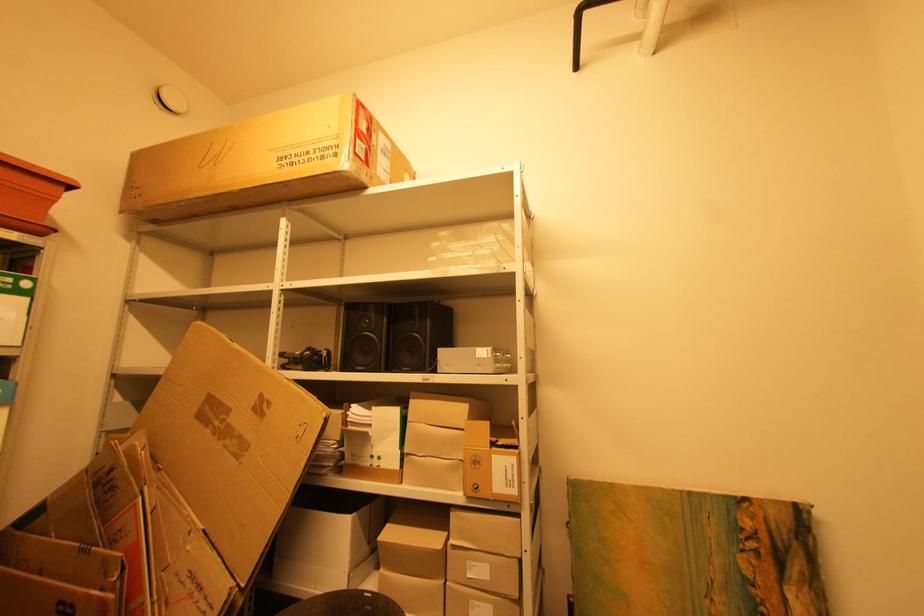
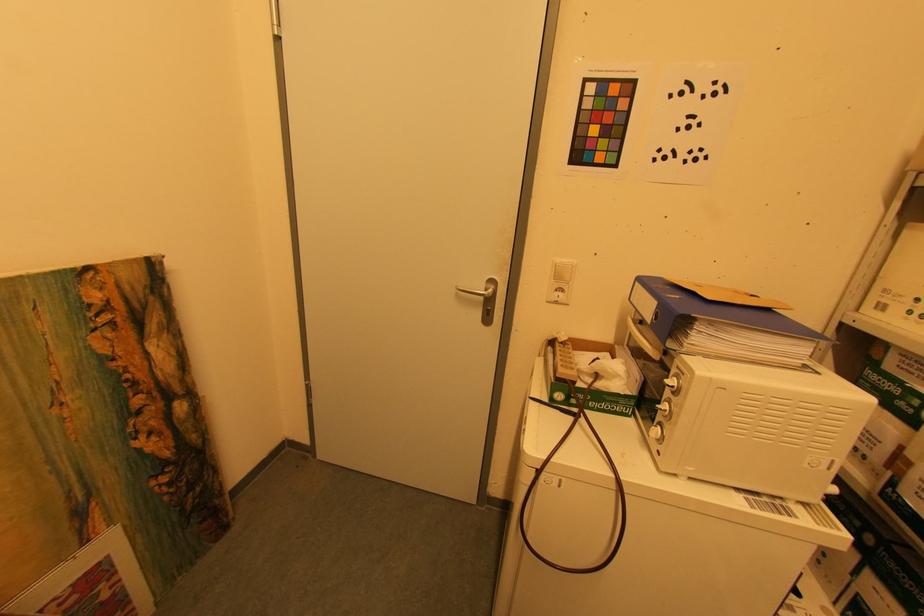
The images are taken continuously from a first-person perspective. In which direction is your viewpoint rotating?

The rotation direction of the camera is right-down.